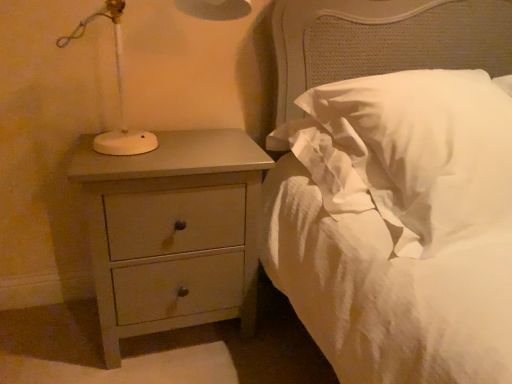
What are the coordinates of `matte gray chest of drawers at left` in the screenshot? It's located at (170, 227).

The height and width of the screenshot is (384, 512). Describe the element at coordinates (170, 227) in the screenshot. I see `matte gray chest of drawers at left` at that location.

What is the approximate width of white soft pillow at upper right?

It is 29.64 inches.

Find the location of `white soft pillow at upper right`. white soft pillow at upper right is located at coordinates (409, 156).

Describe the element at coordinates (409, 156) in the screenshot. The width and height of the screenshot is (512, 384). I see `white soft pillow at upper right` at that location.

You are a GUI agent. You are given a task and a screenshot of the screen. Output one action in this format:
    pyautogui.click(x=<x>, y=<y>)
    Task: Click on the matte gray chest of drawers at left
    This screenshot has height=384, width=512.
    Given the screenshot: What is the action you would take?
    pyautogui.click(x=170, y=227)

Which object is positioned more to the right, matte gray chest of drawers at left or white soft pillow at upper right?

From the viewer's perspective, white soft pillow at upper right appears more on the right side.

In the scene shown: Which is in front, matte gray chest of drawers at left or white soft pillow at upper right?

white soft pillow at upper right is more forward.

Is point (234, 154) positioned before point (360, 174)?

That is False.

From the image's perspective, is matte gray chest of drawers at left located above or below white soft pillow at upper right?

Based on their image positions, matte gray chest of drawers at left is located beneath white soft pillow at upper right.

From a real-world perspective, is matte gray chest of drawers at left positioned under white soft pillow at upper right based on gravity?

Correct, in the physical world, matte gray chest of drawers at left is lower than white soft pillow at upper right.

Does matte gray chest of drawers at left have a greater width compared to white soft pillow at upper right?

No, matte gray chest of drawers at left is not wider than white soft pillow at upper right.

Considering the relative sizes of matte gray chest of drawers at left and white soft pillow at upper right in the image provided, is matte gray chest of drawers at left shorter than white soft pillow at upper right?

No, matte gray chest of drawers at left is not shorter than white soft pillow at upper right.

Does matte gray chest of drawers at left have a smaller size compared to white soft pillow at upper right?

Correct, matte gray chest of drawers at left occupies less space than white soft pillow at upper right.

Is matte gray chest of drawers at left outside of white soft pillow at upper right?

That's correct, matte gray chest of drawers at left is outside of white soft pillow at upper right.

Is matte gray chest of drawers at left placed right next to white soft pillow at upper right?

matte gray chest of drawers at left is not next to white soft pillow at upper right, and they're not touching.

Is matte gray chest of drawers at left positioned with its back to white soft pillow at upper right?

No, matte gray chest of drawers at left is not facing away from white soft pillow at upper right.

How different are the orientations of matte gray chest of drawers at left and white soft pillow at upper right in degrees?

They differ by 0.214 degrees in their facing directions.

Find the location of a particular element. The width and height of the screenshot is (512, 384). pillow that is on the right side of matte gray chest of drawers at left is located at coordinates (409, 156).

Which is more to the left, white soft pillow at upper right or matte gray chest of drawers at left?

Positioned to the left is matte gray chest of drawers at left.

Which object is further away from the camera, white soft pillow at upper right or matte gray chest of drawers at left?

matte gray chest of drawers at left is more distant.

Does point (415, 167) come in front of point (120, 269)?

Yes, point (415, 167) is closer to viewer.

From the image's perspective, between white soft pillow at upper right and matte gray chest of drawers at left, who is located below?

matte gray chest of drawers at left, from the image's perspective.

From a real-world perspective, is white soft pillow at upper right positioned above or below matte gray chest of drawers at left?

Clearly, from a real-world perspective, white soft pillow at upper right is above matte gray chest of drawers at left.

Is white soft pillow at upper right thinner than matte gray chest of drawers at left?

Incorrect, the width of white soft pillow at upper right is not less than that of matte gray chest of drawers at left.

Does white soft pillow at upper right have a greater height compared to matte gray chest of drawers at left?

In fact, white soft pillow at upper right may be shorter than matte gray chest of drawers at left.

Considering the sizes of objects white soft pillow at upper right and matte gray chest of drawers at left in the image provided, who is bigger, white soft pillow at upper right or matte gray chest of drawers at left?

white soft pillow at upper right is bigger.

Is white soft pillow at upper right outside of matte gray chest of drawers at left?

Yes, white soft pillow at upper right is not within matte gray chest of drawers at left.

Is white soft pillow at upper right positioned far away from matte gray chest of drawers at left?

They are positioned close to each other.

Could you tell me if white soft pillow at upper right is turned towards matte gray chest of drawers at left?

No.

Can you tell me how much white soft pillow at upper right and matte gray chest of drawers at left differ in facing direction?

There is a 0.214-degree angle between the facing directions of white soft pillow at upper right and matte gray chest of drawers at left.

Locate an element on the screen. chest of drawers that appears on the left of white soft pillow at upper right is located at coordinates point(170,227).

The width and height of the screenshot is (512, 384). I want to click on pillow above the matte gray chest of drawers at left (from the image's perspective), so click(409, 156).

Find the location of a particular element. pillow that is above the matte gray chest of drawers at left (from a real-world perspective) is located at coordinates (409, 156).